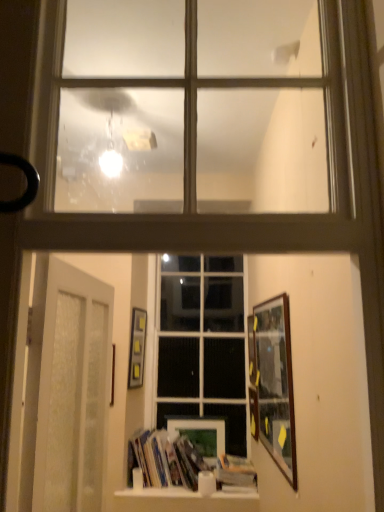
Question: Considering their positions, is white frosted glass door at lower left located in front of or behind wooden picture frame at center, the 1th picture frame from the right?

Choices:
 (A) behind
 (B) front

Answer: (B)

Question: Visually, is white frosted glass door at lower left positioned to the left or to the right of wooden picture frame at center, which is the 5th picture frame from left to right?

Choices:
 (A) right
 (B) left

Answer: (B)

Question: Which object is the closest to the hardcover book at center?

Choices:
 (A) clear glass window at upper center, which appears as the 1th window when viewed from the top
 (B) hardcover books at center
 (C) wooden picture frame at center, the 2th picture frame in the left-to-right sequence
 (D) wooden picture frame at center, the 1th picture frame from the right
 (E) white frosted glass door at lower left

Answer: (B)

Question: Estimate the real-world distances between objects in this image. Which object is closer to the wooden picture frame at center, marked as the second picture frame in a right-to-left arrangement?

Choices:
 (A) hardcover book at center
 (B) white frosted glass door at lower left
 (C) wooden picture frame at center, the 1th picture frame from the right
 (D) hardcover books at center
 (E) matte black picture frame at center-left, the 5th picture frame from the right

Answer: (C)